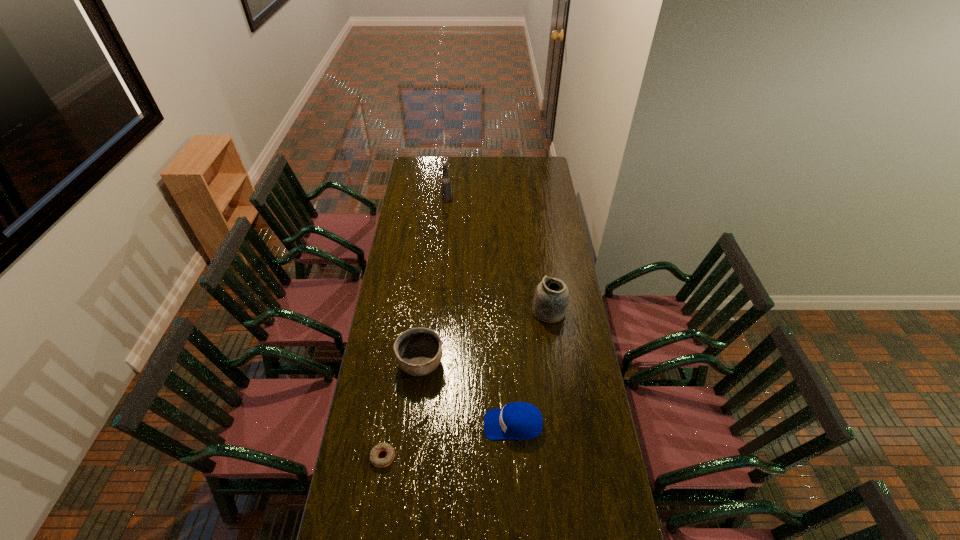
The image size is (960, 540). In the image, there is a desktop. Identify the location of vacant space at the left edge. (400, 329).

The height and width of the screenshot is (540, 960). What are the coordinates of `vacant space at the right edge` in the screenshot? It's located at (547, 248).

Locate an element on the screen. Image resolution: width=960 pixels, height=540 pixels. vacant area at the far left corner is located at coordinates (433, 171).

Find the location of a particular element. Image resolution: width=960 pixels, height=540 pixels. free space that is in between the left pottery and the shortest object is located at coordinates (402, 410).

This screenshot has width=960, height=540. I want to click on empty space between the fourth object from left to right and the left pottery, so click(468, 394).

Identify the location of vacant point located between the left pottery and the fourth farthest object. (468, 394).

Image resolution: width=960 pixels, height=540 pixels. Find the location of `empty space that is in between the shorter pottery and the doughnut`. empty space that is in between the shorter pottery and the doughnut is located at coordinates (402, 410).

The image size is (960, 540). I want to click on vacant area that lies between the third tallest object and the nearest object, so (x=402, y=410).

Locate an element on the screen. This screenshot has width=960, height=540. empty space that is in between the farthest object and the fourth farthest object is located at coordinates click(480, 312).

Where is `empty space between the baseball cap and the taller pottery`? empty space between the baseball cap and the taller pottery is located at coordinates (532, 368).